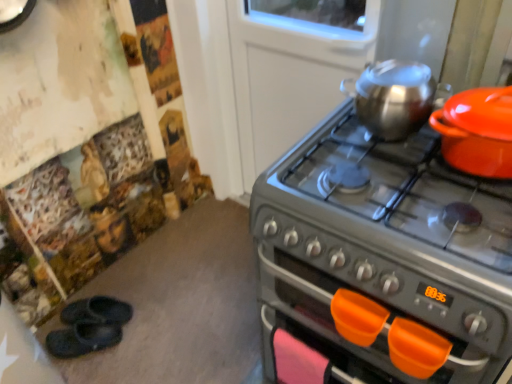
This screenshot has width=512, height=384. In order to click on free spot above metallic gray gas stove at right (from a real-world perspective) in this screenshot , I will do `click(408, 185)`.